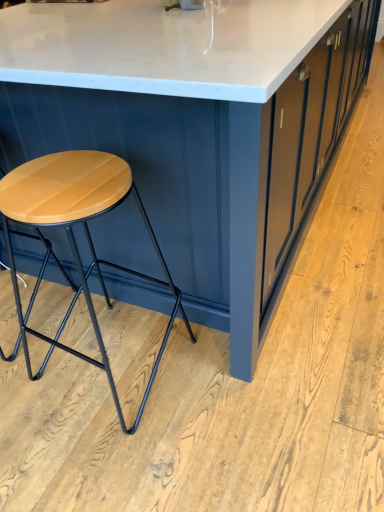
The width and height of the screenshot is (384, 512). What do you see at coordinates (74, 237) in the screenshot?
I see `wooden matte stool at left` at bounding box center [74, 237].

Locate an element on the screen. Image resolution: width=384 pixels, height=512 pixels. wooden matte stool at left is located at coordinates (74, 237).

In the scene shown: Measure the distance between point (30,42) and camera.

Point (30,42) and camera are 1.18 meters apart.

What do you see at coordinates (168, 114) in the screenshot? I see `white marble table at center` at bounding box center [168, 114].

The image size is (384, 512). I want to click on white marble table at center, so click(168, 114).

Where is `wooden matte stool at left`? wooden matte stool at left is located at coordinates (74, 237).

Would you say white marble table at center is to the left or to the right of wooden matte stool at left in the picture?

From the image, it's evident that white marble table at center is to the right of wooden matte stool at left.

Which is behind, white marble table at center or wooden matte stool at left?

Positioned behind is wooden matte stool at left.

Which is in front, point (246, 52) or point (76, 156)?

The point (246, 52) is closer.

From the image's perspective, does white marble table at center appear lower than wooden matte stool at left?

No, from the image's perspective, white marble table at center is not below wooden matte stool at left.

From a real-world perspective, is white marble table at center above or below wooden matte stool at left?

white marble table at center is situated higher than wooden matte stool at left in the real world.

Is white marble table at center wider or thinner than wooden matte stool at left?

white marble table at center is wider than wooden matte stool at left.

Can you confirm if white marble table at center is taller than wooden matte stool at left?

Correct, white marble table at center is much taller as wooden matte stool at left.

Can you confirm if white marble table at center is smaller than wooden matte stool at left?

Actually, white marble table at center might be larger than wooden matte stool at left.

Is white marble table at center not inside wooden matte stool at left?

That's correct, white marble table at center is outside of wooden matte stool at left.

Are white marble table at center and wooden matte stool at left far apart?

white marble table at center is near wooden matte stool at left, not far away.

Is white marble table at center looking in the opposite direction of wooden matte stool at left?

No, wooden matte stool at left is not at the back of white marble table at center.

What's the angular difference between white marble table at center and wooden matte stool at left's facing directions?

88.5 degrees.

How distant is white marble table at center from wooden matte stool at left?

white marble table at center is 12.64 inches away from wooden matte stool at left.

At what (x,y) coordinates should I click in order to perform the action: click on stool located below the white marble table at center (from the image's perspective). Please return your answer as a coordinate pair (x, y). This screenshot has height=512, width=384. Looking at the image, I should click on (74, 237).

Is wooden matte stool at left to the left of white marble table at center from the viewer's perspective?

Yes.

Does wooden matte stool at left lie in front of white marble table at center?

No, it is not.

Which is closer, (x=60, y=175) or (x=134, y=93)?

The point (x=134, y=93) is more forward.

From the image's perspective, relative to white marble table at center, is wooden matte stool at left above or below?

wooden matte stool at left is below white marble table at center.

From a real-world perspective, which is physically below, wooden matte stool at left or white marble table at center?

From a 3D spatial view, wooden matte stool at left is below.

In terms of width, does wooden matte stool at left look wider or thinner when compared to white marble table at center?

Considering their sizes, wooden matte stool at left looks slimmer than white marble table at center.

Considering the sizes of objects wooden matte stool at left and white marble table at center in the image provided, who is taller, wooden matte stool at left or white marble table at center?

white marble table at center is taller.

Is wooden matte stool at left smaller than white marble table at center?

Yes, wooden matte stool at left is smaller than white marble table at center.

Would you say wooden matte stool at left is inside or outside white marble table at center?

The correct answer is: inside.

Is wooden matte stool at left far away from white marble table at center?

No, wooden matte stool at left is not far away from white marble table at center.

Is wooden matte stool at left aimed at white marble table at center?

Yes, wooden matte stool at left is aimed at white marble table at center.

How much distance is there between wooden matte stool at left and white marble table at center?

The distance of wooden matte stool at left from white marble table at center is 12.64 inches.

Where is `table lying on the right of wooden matte stool at left`? Image resolution: width=384 pixels, height=512 pixels. table lying on the right of wooden matte stool at left is located at coordinates (168, 114).

Where is `table above the wooden matte stool at left (from the image's perspective)`? table above the wooden matte stool at left (from the image's perspective) is located at coordinates 168,114.

Where is `stool lying on the left of white marble table at center`? Image resolution: width=384 pixels, height=512 pixels. stool lying on the left of white marble table at center is located at coordinates (74, 237).